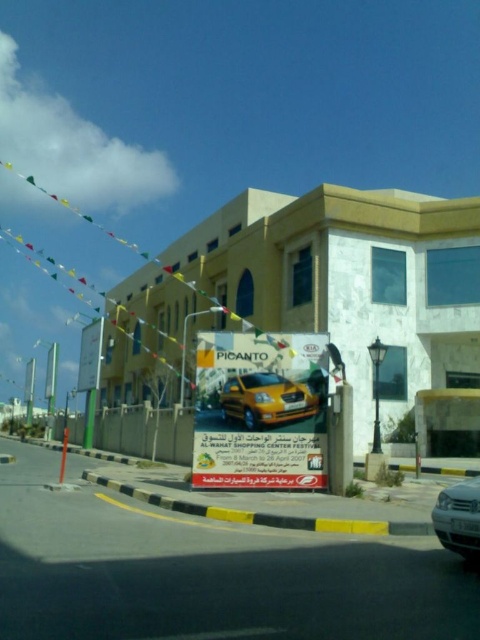
From the picture: You are standing in front of the commercial building and want to determine the relative positions of two points marked on the advertisement sign. Which point is closer to you, point (295,346) or point (435,509)?

Point (295,346) is further to the viewer than point (435,509), so the closer point to you is point (435,509).

You are a delivery person trying to park your van between the two yellow cars at the center. The van requires a space of at least 2 meters. Based on the scene, can you determine if the space between the yellow glossy car at center and the yellow matte car at center is sufficient?

The yellow glossy car at center might be wider than yellow matte car at center, so the space between them may not be sufficient for the van requiring 2 meters. It is uncertain without exact measurements.

You are a photographer standing in front of the commercial building. You want to take a photo of the yellow glossy car at center and the silver metallic car at lower right. Which car should you focus on first if you want to include both in the frame without moving the camera?

You should focus on the yellow glossy car at center first because it is much taller than the silver metallic car at lower right, so it will occupy more space in the frame and ensure both cars are visible.